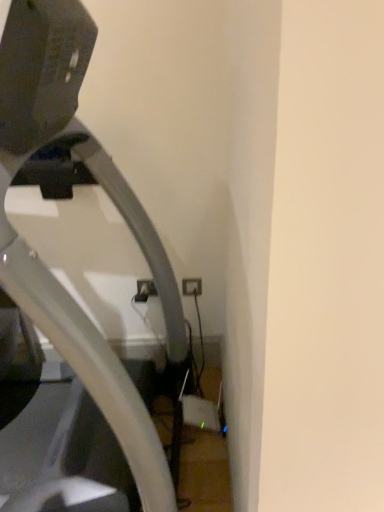
Question: Considering the positions of metallic gray treadmill at left and white plastic electric outlet at lower center in the image, is metallic gray treadmill at left wider or thinner than white plastic electric outlet at lower center?

Choices:
 (A) thin
 (B) wide

Answer: (B)

Question: From a real-world perspective, is metallic gray treadmill at left above or below white plastic electric outlet at lower center?

Choices:
 (A) above
 (B) below

Answer: (A)

Question: Would you say metallic gray treadmill at left is inside or outside white plastic electric outlet at lower center?

Choices:
 (A) outside
 (B) inside

Answer: (A)

Question: Considering the positions of point (185, 282) and point (46, 136), is point (185, 282) closer or farther from the camera than point (46, 136)?

Choices:
 (A) farther
 (B) closer

Answer: (A)

Question: From a real-world perspective, is white plastic electric outlet at lower center above or below metallic gray treadmill at left?

Choices:
 (A) below
 (B) above

Answer: (A)

Question: In terms of width, does white plastic electric outlet at lower center look wider or thinner when compared to metallic gray treadmill at left?

Choices:
 (A) wide
 (B) thin

Answer: (B)

Question: In terms of height, does white plastic electric outlet at lower center look taller or shorter compared to metallic gray treadmill at left?

Choices:
 (A) short
 (B) tall

Answer: (A)